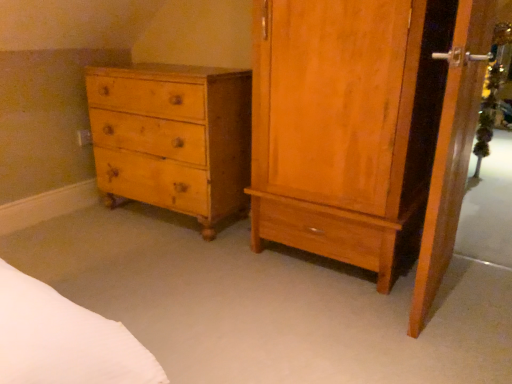
Question: Is light brown wood cabinet at right behind wooden screen door at right?

Choices:
 (A) no
 (B) yes

Answer: (B)

Question: Does light brown wood cabinet at right have a greater width compared to wooden screen door at right?

Choices:
 (A) yes
 (B) no

Answer: (A)

Question: Considering the relative sizes of light brown wood cabinet at right and wooden screen door at right in the image provided, is light brown wood cabinet at right bigger than wooden screen door at right?

Choices:
 (A) no
 (B) yes

Answer: (B)

Question: Is light brown wood cabinet at right facing away from wooden screen door at right?

Choices:
 (A) yes
 (B) no

Answer: (B)

Question: From a real-world perspective, is light brown wood cabinet at right below wooden screen door at right?

Choices:
 (A) yes
 (B) no

Answer: (B)

Question: In the image, is wooden screen door at right on the left side or the right side of yellow wood chest of drawers at left?

Choices:
 (A) left
 (B) right

Answer: (B)

Question: Considering the positions of point (466, 150) and point (183, 132), is point (466, 150) closer or farther from the camera than point (183, 132)?

Choices:
 (A) farther
 (B) closer

Answer: (B)

Question: In terms of size, does wooden screen door at right appear bigger or smaller than yellow wood chest of drawers at left?

Choices:
 (A) big
 (B) small

Answer: (B)

Question: From the image's perspective, relative to yellow wood chest of drawers at left, is wooden screen door at right above or below?

Choices:
 (A) above
 (B) below

Answer: (B)

Question: In terms of size, does light brown wood cabinet at right appear bigger or smaller than yellow wood chest of drawers at left?

Choices:
 (A) small
 (B) big

Answer: (B)

Question: Is light brown wood cabinet at right situated inside yellow wood chest of drawers at left or outside?

Choices:
 (A) outside
 (B) inside

Answer: (A)

Question: In terms of height, does light brown wood cabinet at right look taller or shorter compared to yellow wood chest of drawers at left?

Choices:
 (A) tall
 (B) short

Answer: (A)

Question: In the image, is light brown wood cabinet at right positioned in front of or behind yellow wood chest of drawers at left?

Choices:
 (A) behind
 (B) front

Answer: (B)

Question: Is wooden screen door at right inside the boundaries of light brown wood cabinet at right, or outside?

Choices:
 (A) outside
 (B) inside

Answer: (A)

Question: From their relative heights in the image, would you say wooden screen door at right is taller or shorter than light brown wood cabinet at right?

Choices:
 (A) tall
 (B) short

Answer: (B)